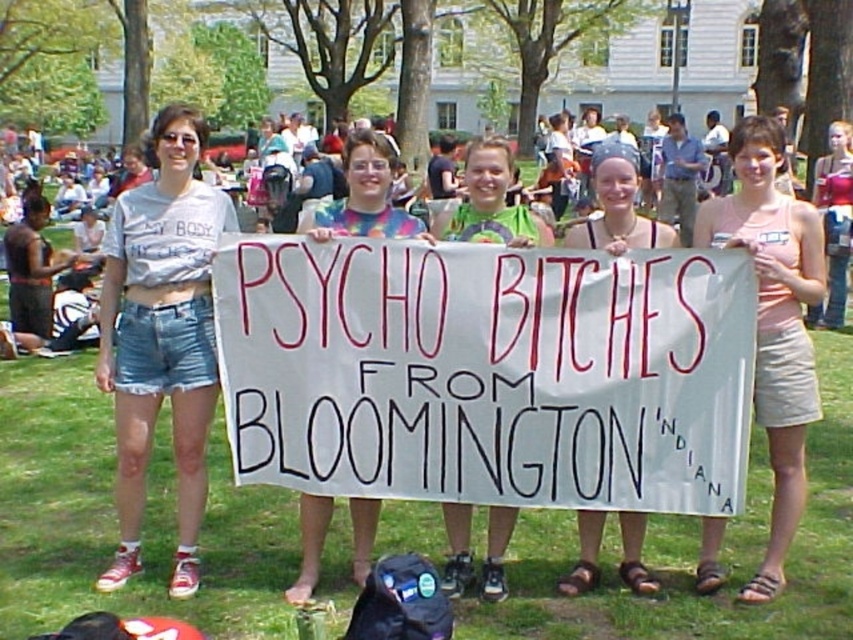
Looking at this image, you are a photographer at the event and want to capture a clear photo of the green jersey at center and denim shorts at center. Which item should you focus on first to ensure both are in focus?

The green jersey at center is in front of the denim shorts at center. To ensure both are in focus, you should focus on the green jersey at center first, as it is closer to the camera.

You are organizing a photoshoot and need to ensure that the beige cotton dress at center and denim shorts at center are visible in the frame. Given their sizes, which one might require more careful positioning to avoid being obscured by other elements?

The beige cotton dress at center is smaller than the denim shorts at center, so it might require more careful positioning to avoid being obscured by other elements.